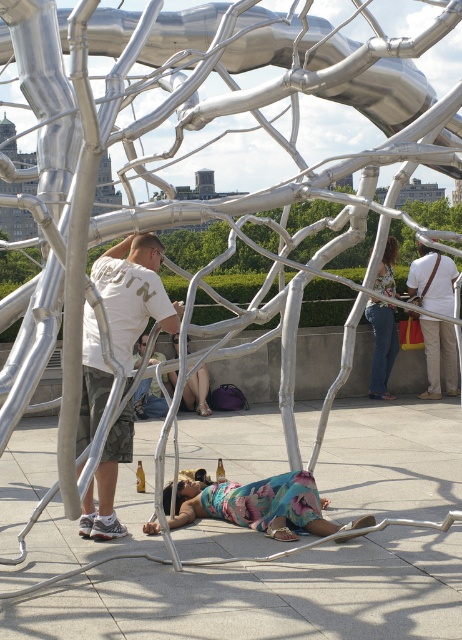
Question: Among these objects, which one is farthest from the camera?

Choices:
 (A) jeans at center
 (B) matte white shirt at center
 (C) light brown leather bag at center right
 (D) white cotton t-shirt at center

Answer: (C)

Question: Which of these objects is positioned farthest from the multicolored fabric at center?

Choices:
 (A) matte white shirt at center
 (B) light brown leather bag at center right

Answer: (B)

Question: Estimate the real-world distances between objects in this image. Which object is closer to the multicolored fabric at center?

Choices:
 (A) light brown leather bag at center right
 (B) jeans at center
 (C) matte white shirt at center

Answer: (C)

Question: Can you confirm if multicolored fabric at center is positioned to the left of matte white shirt at center?

Choices:
 (A) yes
 (B) no

Answer: (B)

Question: Can you confirm if jeans at center is positioned below matte white shirt at center?

Choices:
 (A) no
 (B) yes

Answer: (A)

Question: Is white cotton t-shirt at center above matte white shirt at center?

Choices:
 (A) no
 (B) yes

Answer: (B)